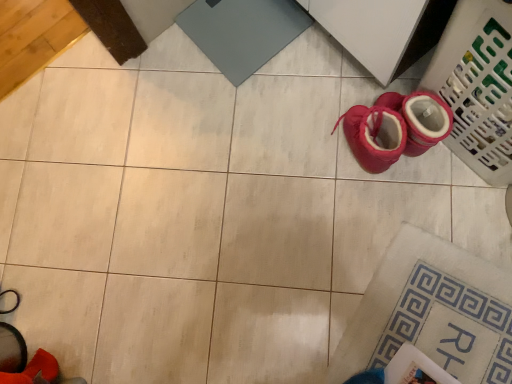
Question: Considering the positions of red suede boot at lower left and plastic laundry basket at lower right in the image, is red suede boot at lower left bigger or smaller than plastic laundry basket at lower right?

Choices:
 (A) big
 (B) small

Answer: (B)

Question: Considering the positions of point (38, 367) and point (495, 59), is point (38, 367) closer or farther from the camera than point (495, 59)?

Choices:
 (A) closer
 (B) farther

Answer: (B)

Question: Is red suede boot at lower left spatially inside plastic laundry basket at lower right, or outside of it?

Choices:
 (A) inside
 (B) outside

Answer: (B)

Question: Is point (502, 122) closer or farther from the camera than point (33, 365)?

Choices:
 (A) closer
 (B) farther

Answer: (A)

Question: Is plastic laundry basket at lower right wider or thinner than red suede boot at lower left?

Choices:
 (A) thin
 (B) wide

Answer: (B)

Question: In the image, is plastic laundry basket at lower right positioned in front of or behind red suede boot at lower left?

Choices:
 (A) behind
 (B) front

Answer: (A)

Question: From a real-world perspective, is plastic laundry basket at lower right positioned above or below red suede boot at lower left?

Choices:
 (A) above
 (B) below

Answer: (B)